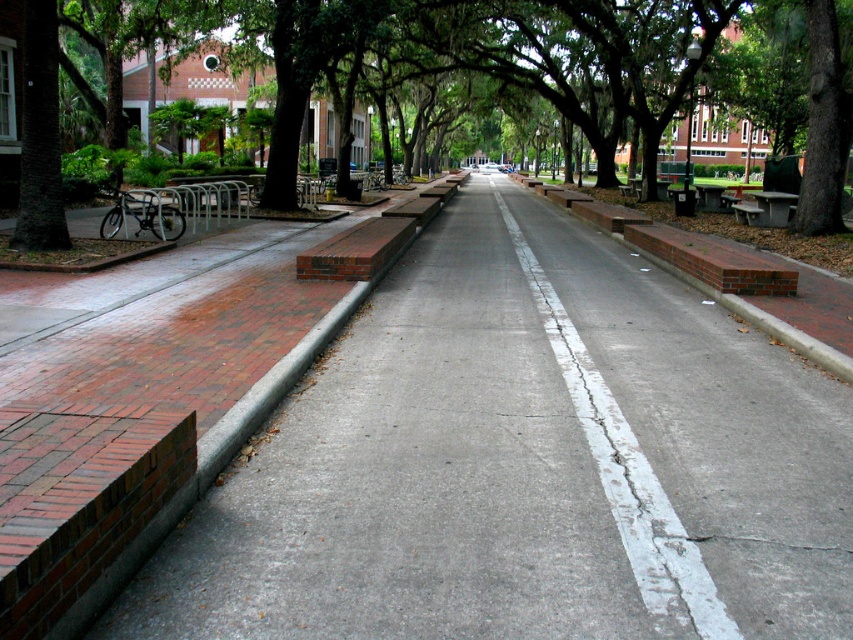
Question: Which object is the farthest from the green leafy tree at center?

Choices:
 (A) white cracked concrete at center
 (B) gray concrete bench at center

Answer: (B)

Question: Which object is positioned farthest from the green leafy tree at center?

Choices:
 (A) white cracked concrete at center
 (B) gray concrete bench at center

Answer: (B)

Question: Does green leafy tree at center have a larger size compared to gray concrete bench at center?

Choices:
 (A) yes
 (B) no

Answer: (A)

Question: Does gray concrete pavement at left appear on the right side of white cracked concrete at center?

Choices:
 (A) no
 (B) yes

Answer: (A)

Question: Among these points, which one is nearest to the camera?

Choices:
 (A) (738, 204)
 (B) (471, 3)
 (C) (618, 502)

Answer: (C)

Question: Does gray concrete pavement at left have a larger size compared to white cracked concrete at center?

Choices:
 (A) no
 (B) yes

Answer: (B)